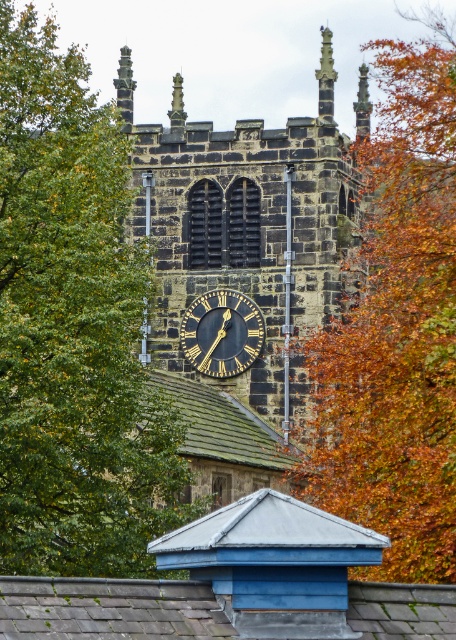
In the scene shown: You are standing 50 meters away from the historic stone church tower. You notice a green leafy tree at upper left in the scene. Is the tree closer to you or farther than the tower?

The green leafy tree at upper left is 74.77 meters away from the viewer, which is farther than the tower at 50 meters. Therefore, the tree is farther away than the tower.

You are standing at the base of the historic stone church tower and notice a green leafy tree at upper left. Based on its coordinates, is the tree positioned closer to the left or right side of the tower?

The green leafy tree at upper left is located at point 0.514 on the x and 0.160 on the y, so it is positioned closer to the left side of the tower since the x coordinate is less than 0.5.

You are a window cleaner with a ladder that can extend up to 25 meters. You need to clean both the green leafy tree at upper left and the black polished stone clock at center. Can you reach both with your ladder?

The distance between the green leafy tree at upper left and the black polished stone clock at center is 26.02 meters. Since your ladder can only extend up to 25 meters, you cannot reach both locations with a single ladder. You would need a longer ladder or additional equipment to cover the entire distance.